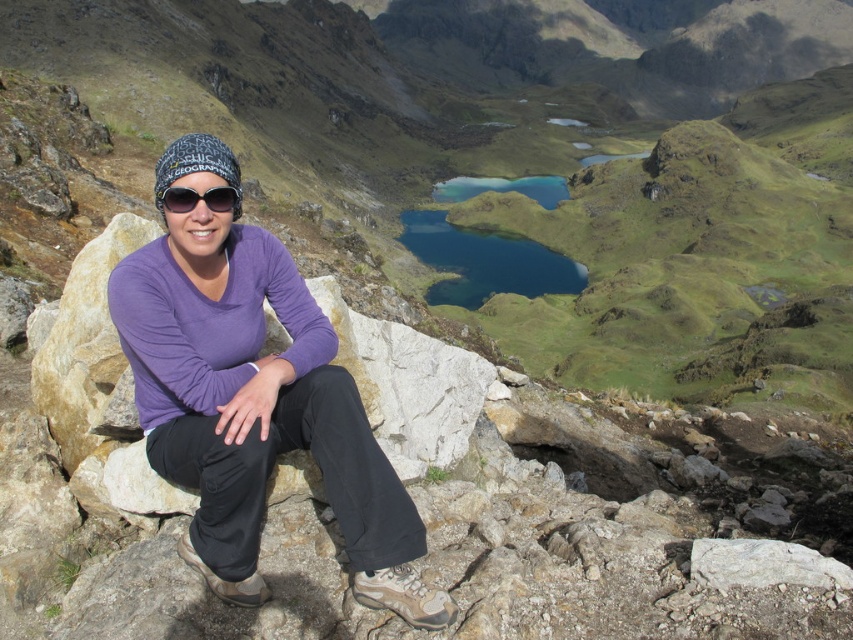
What do you see at coordinates (253, 396) in the screenshot? The height and width of the screenshot is (640, 853). I see `purple cotton shirt at center` at bounding box center [253, 396].

Is point (364, 483) positioned in front of point (228, 205)?

Yes, it is in front of point (228, 205).

Measure the distance between purple cotton shirt at center and camera.

The distance of purple cotton shirt at center from camera is 5.03 meters.

Find the location of a particular element. The height and width of the screenshot is (640, 853). purple cotton shirt at center is located at coordinates (253, 396).